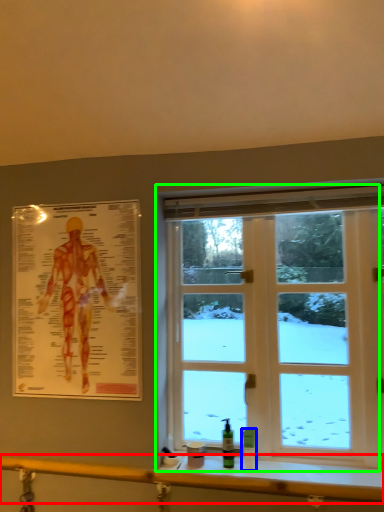
Question: Which object is the farthest from rail (highlighted by a red box)? Choose among these: toiletry (highlighted by a blue box) or window (highlighted by a green box).

Choices:
 (A) toiletry
 (B) window

Answer: (B)